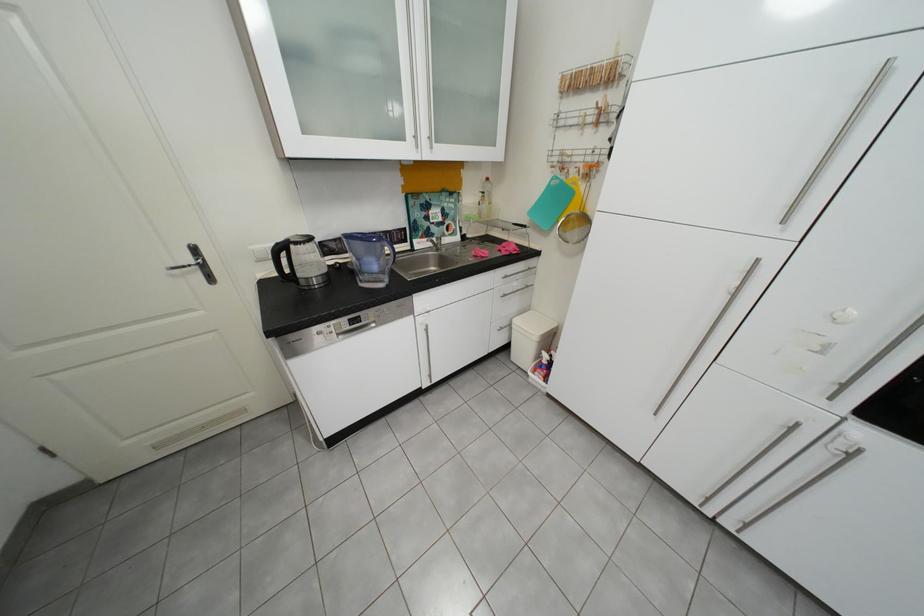
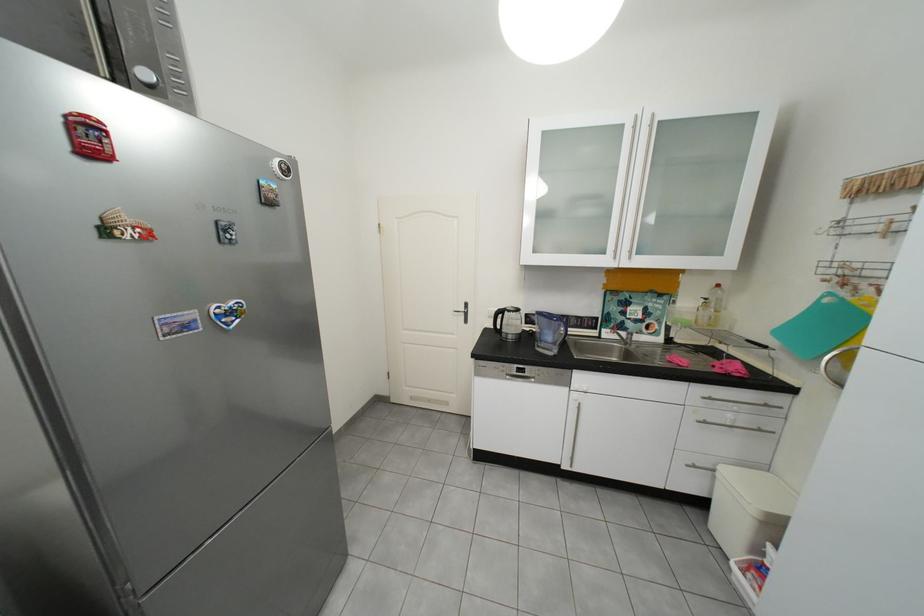
In the second image, find the point that corresponds to (x=517, y=278) in the first image.

(723, 400)